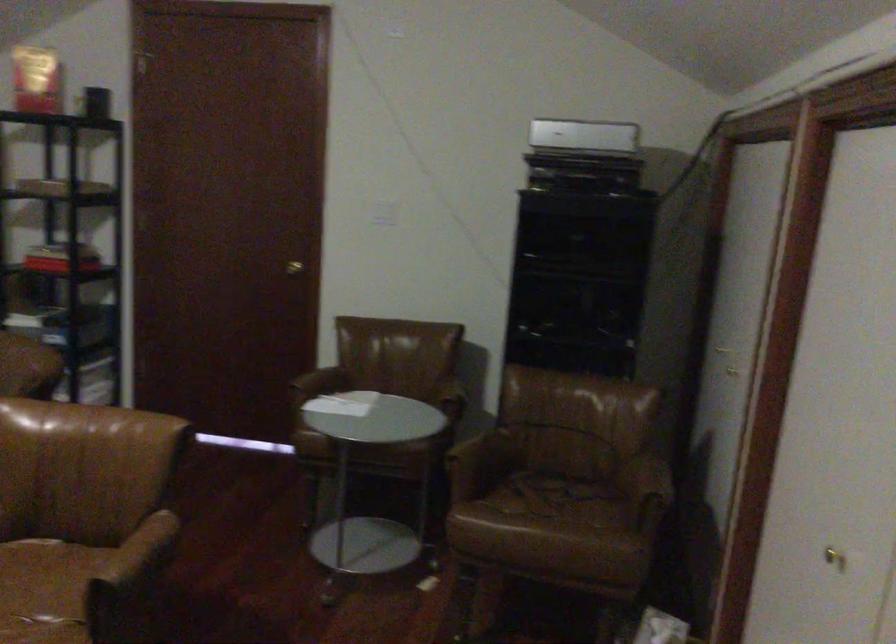
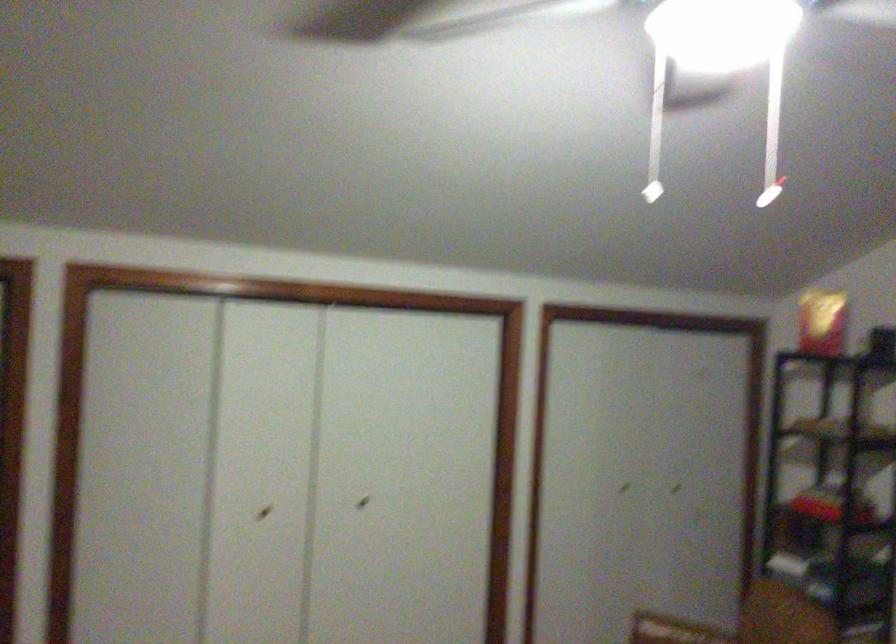
Question: The first image is from the beginning of the video and the second image is from the end. How did the camera likely rotate when shooting the video?

Choices:
 (A) Left
 (B) Right
 (C) Up
 (D) Down

Answer: (A)